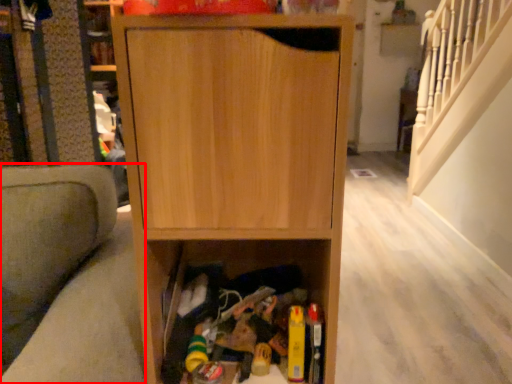
Question: From the image's perspective, what is the correct spatial relationship of armchair (annotated by the red box) in relation to cabinetry?

Choices:
 (A) below
 (B) above

Answer: (A)